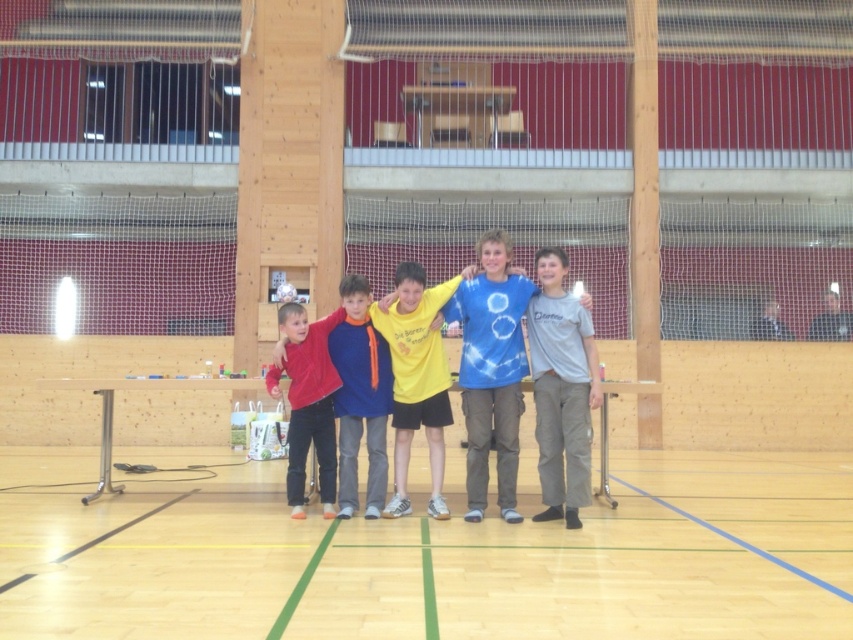
Question: Which object is positioned farthest from the yellow matte shirt at center?

Choices:
 (A) gray cotton shirt at right
 (B) blue cotton shirt at center
 (C) blue tie-dye shirt at center
 (D) velvet red sweater at center

Answer: (A)

Question: Is wooden floor at center smaller than velvet red sweater at center?

Choices:
 (A) yes
 (B) no

Answer: (B)

Question: Which point is closer to the camera?

Choices:
 (A) (x=335, y=548)
 (B) (x=318, y=365)
 (C) (x=479, y=512)

Answer: (A)

Question: Is wooden floor at center further to the viewer compared to dark gray shirt at right?

Choices:
 (A) yes
 (B) no

Answer: (B)

Question: Among these objects, which one is farthest from the camera?

Choices:
 (A) blue cotton shirt at center
 (B) gray cotton shirt at right
 (C) wooden floor at center

Answer: (A)

Question: Is blue tie-dye shirt at center thinner than blue cotton shirt at center?

Choices:
 (A) yes
 (B) no

Answer: (B)